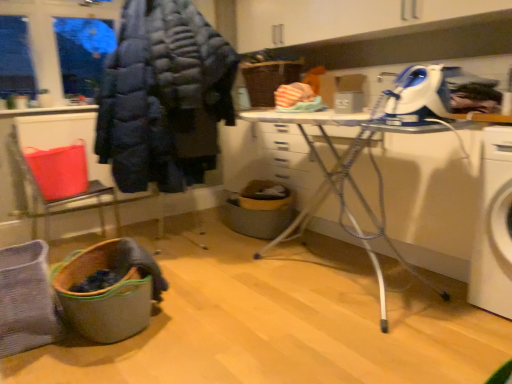
This screenshot has height=384, width=512. In order to click on free space in front of dark blue puffer jacket at upper left in this screenshot , I will do `click(221, 294)`.